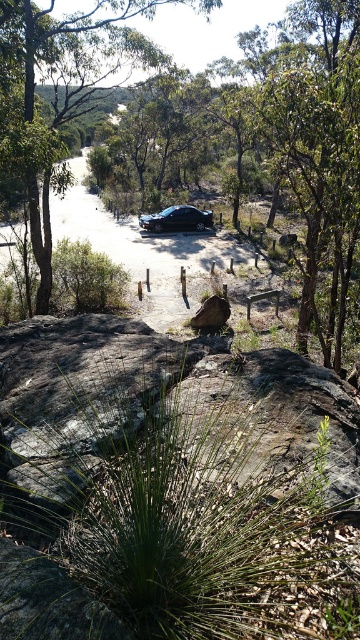
Who is positioned more to the left, green leafy tree at center or brown rough boulder at center?

green leafy tree at center is more to the left.

From the picture: Is green leafy tree at center to the right of brown rough boulder at center from the viewer's perspective?

In fact, green leafy tree at center is to the left of brown rough boulder at center.

Who is more distant from viewer, (10, 38) or (218, 296)?

Point (218, 296)

Where is `green leafy tree at center`? This screenshot has height=640, width=360. green leafy tree at center is located at coordinates (59, 92).

The image size is (360, 640). Describe the element at coordinates (177, 220) in the screenshot. I see `shiny black car at center` at that location.

Between point (158, 216) and point (198, 320), which one is positioned in front?

Positioned in front is point (198, 320).

Which is behind, point (146, 216) or point (209, 328)?

The point (146, 216) is more distant.

At what (x,y) coordinates should I click in order to perform the action: click on shiny black car at center. Please return your answer as a coordinate pair (x, y). Looking at the image, I should click on (177, 220).

Between green leafy tree at center and shiny black car at center, which one appears on the right side from the viewer's perspective?

shiny black car at center

Locate an element on the screen. The image size is (360, 640). green leafy tree at center is located at coordinates [59, 92].